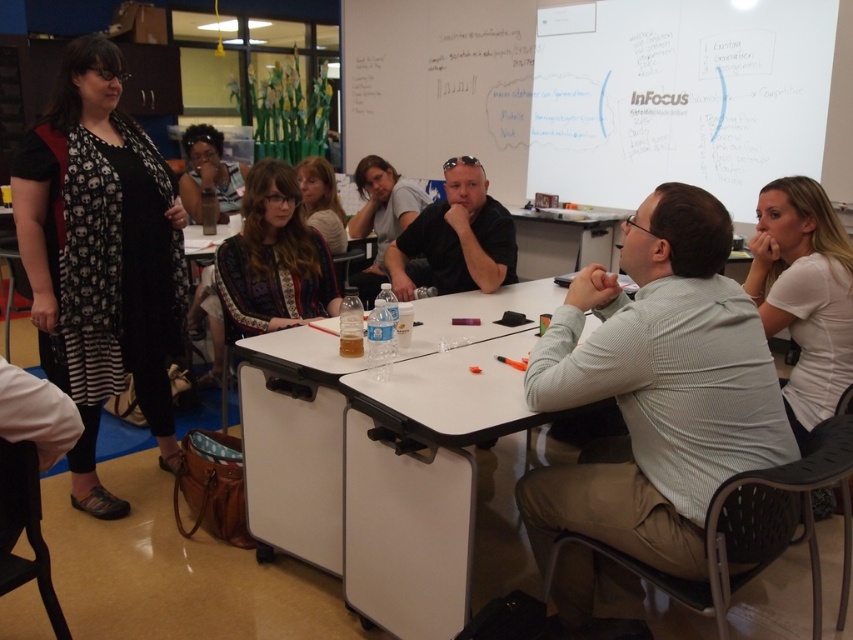
Question: Which point is farther to the camera?

Choices:
 (A) patterned fabric shirt at center
 (B) black matte shirt at center
 (C) matte black glasses at upper center
 (D) black printed dress at left

Answer: (C)

Question: Considering the real-world distances, which object is farthest from the matte gray shirt at center?

Choices:
 (A) matte black glasses at upper center
 (B) black printed dress at left
 (C) whiteboard at upper center

Answer: (C)

Question: Is black printed dress at left below patterned fabric shirt at center?

Choices:
 (A) yes
 (B) no

Answer: (A)

Question: Can you confirm if gray striped shirt at center is positioned above black matte shirt at center?

Choices:
 (A) no
 (B) yes

Answer: (A)

Question: Which is farther from the black matte shirt at center?

Choices:
 (A) matte black glasses at upper center
 (B) gray striped shirt at center
 (C) patterned fabric shirt at center

Answer: (A)

Question: Does gray striped shirt at center have a greater width compared to matte black glasses at upper center?

Choices:
 (A) no
 (B) yes

Answer: (B)